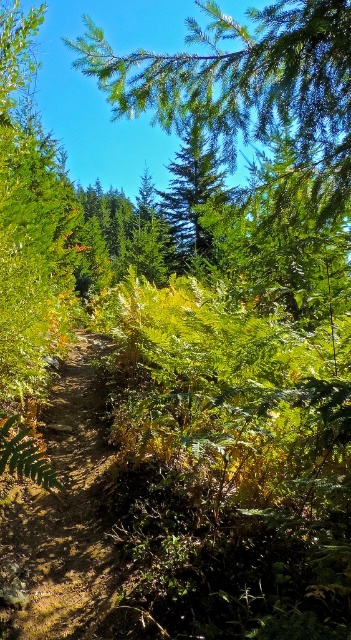
Question: Which object appears closest to the camera in this image?

Choices:
 (A) dirt path at center
 (B) green needle-like leaves at upper center
 (C) green matte tree at upper center

Answer: (B)

Question: Can you confirm if green needle-like leaves at upper center is bigger than green matte tree at upper center?

Choices:
 (A) no
 (B) yes

Answer: (A)

Question: Which point is farther from the camera taking this photo?

Choices:
 (A) (50, 512)
 (B) (230, 148)

Answer: (A)

Question: Is dirt path at center to the right of green matte tree at upper center from the viewer's perspective?

Choices:
 (A) no
 (B) yes

Answer: (A)

Question: Which point is farther to the camera?

Choices:
 (A) green matte tree at upper center
 (B) dirt path at center

Answer: (A)

Question: Does dirt path at center have a greater width compared to green matte tree at upper center?

Choices:
 (A) no
 (B) yes

Answer: (A)